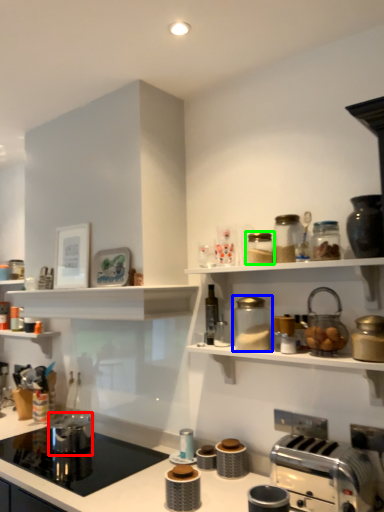
Question: Considering the real-world distances, which object is closest to appliance (highlighted by a red box)? appliance (highlighted by a blue box) or appliance (highlighted by a green box).

Choices:
 (A) appliance
 (B) appliance

Answer: (A)